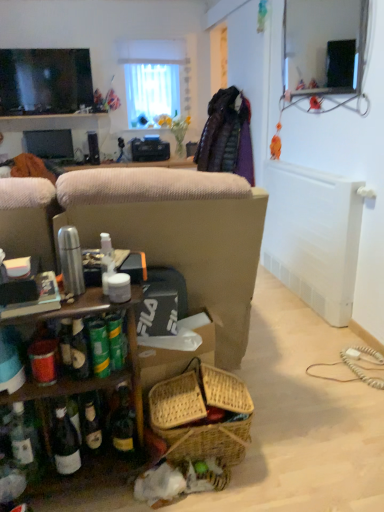
Question: Can matte black monitor at left, acting as the 2th television starting from the top, be found inside white sheer curtain at upper center?

Choices:
 (A) yes
 (B) no

Answer: (B)

Question: Does white sheer curtain at upper center have a lesser height compared to matte black monitor at left, the 2th television from the front?

Choices:
 (A) yes
 (B) no

Answer: (B)

Question: Is white sheer curtain at upper center smaller than matte black monitor at left, the 2th television from the front?

Choices:
 (A) yes
 (B) no

Answer: (B)

Question: Is white sheer curtain at upper center oriented away from matte black monitor at left, acting as the 2th television starting from the top?

Choices:
 (A) no
 (B) yes

Answer: (A)

Question: Considering the relative sizes of white sheer curtain at upper center and matte black monitor at left, which appears as the first television when ordered from the bottom, in the image provided, is white sheer curtain at upper center taller than matte black monitor at left, which appears as the first television when ordered from the bottom,?

Choices:
 (A) no
 (B) yes

Answer: (B)

Question: Is white sheer curtain at upper center wider or thinner than matte black monitor at left, which appears as the first television when viewed from the back?

Choices:
 (A) wide
 (B) thin

Answer: (A)

Question: Is point (185, 96) closer or farther from the camera than point (59, 140)?

Choices:
 (A) closer
 (B) farther

Answer: (B)

Question: Relative to matte black monitor at left, which appears as the first television when ordered from the bottom, is white sheer curtain at upper center in front or behind?

Choices:
 (A) behind
 (B) front

Answer: (A)

Question: Is white sheer curtain at upper center inside the boundaries of matte black monitor at left, the 2th television from the front, or outside?

Choices:
 (A) inside
 (B) outside

Answer: (B)

Question: Choose the correct answer: Is white sheer curtain at upper center inside matte black tv at upper left, placed as the second television when sorted from bottom to top, or outside it?

Choices:
 (A) inside
 (B) outside

Answer: (B)

Question: From a real-world perspective, is white sheer curtain at upper center above or below matte black tv at upper left, the first television viewed from the top?

Choices:
 (A) above
 (B) below

Answer: (A)

Question: Is white sheer curtain at upper center taller or shorter than matte black tv at upper left, placed as the second television when sorted from bottom to top?

Choices:
 (A) tall
 (B) short

Answer: (A)

Question: In terms of width, does white sheer curtain at upper center look wider or thinner when compared to matte black tv at upper left, the 1th television positioned from the front?

Choices:
 (A) thin
 (B) wide

Answer: (B)

Question: Does point (66, 150) appear closer or farther from the camera than point (3, 69)?

Choices:
 (A) closer
 (B) farther

Answer: (B)

Question: Is matte black monitor at left, which appears as the first television when ordered from the bottom, bigger or smaller than matte black tv at upper left, the first television viewed from the top?

Choices:
 (A) small
 (B) big

Answer: (A)